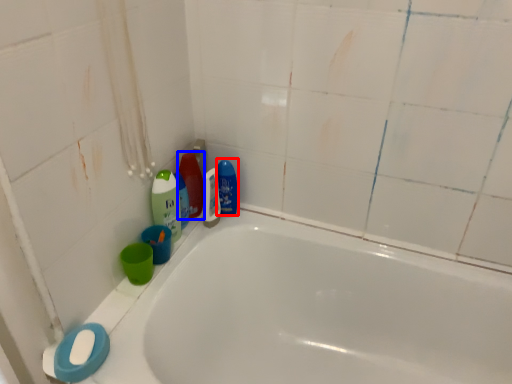
Question: Which point is closer to the camera, cleaning product (highlighted by a red box) or cleaning product (highlighted by a blue box)?

Choices:
 (A) cleaning product
 (B) cleaning product

Answer: (B)